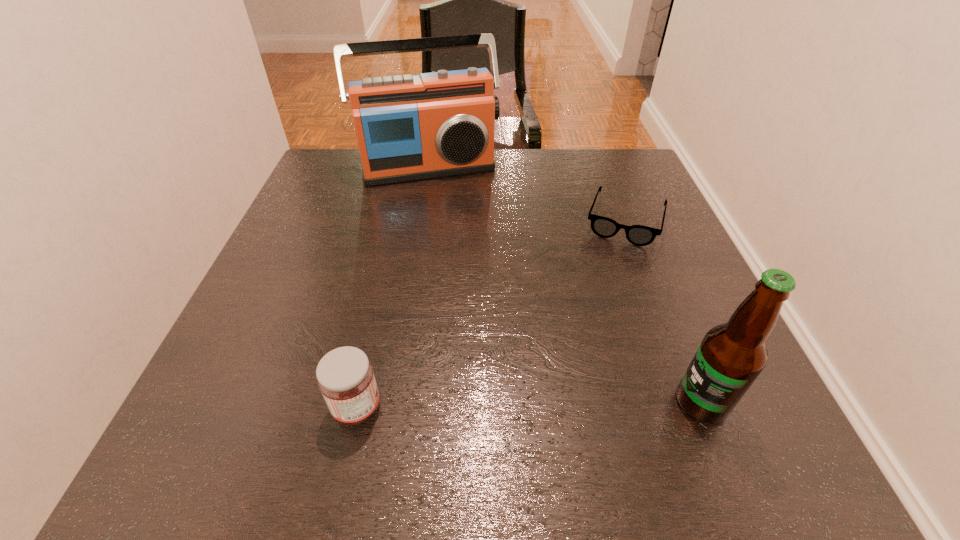
You are a GUI agent. You are given a task and a screenshot of the screen. Output one action in this format:
    pyautogui.click(x=<x>, y=<y>)
    Task: Click on the jam
    The width and height of the screenshot is (960, 540).
    Given the screenshot: What is the action you would take?
    pyautogui.click(x=345, y=376)

Locate an element on the screen. This screenshot has height=540, width=960. the third shortest object is located at coordinates (731, 356).

Locate an element on the screen. the farthest object is located at coordinates pos(438,124).

Find the location of a particular element. the shortest object is located at coordinates (639, 235).

Locate an element on the screen. spectacles is located at coordinates (639, 235).

Find the location of a particular element. The width and height of the screenshot is (960, 540). vacant point located 0.330m on the back of the jam is located at coordinates (391, 255).

You are a GUI agent. You are given a task and a screenshot of the screen. Output one action in this format:
    pyautogui.click(x=<x>, y=<y>)
    Task: Click on the vacant space located on the label of the third shortest object
    The width and height of the screenshot is (960, 540).
    Given the screenshot: What is the action you would take?
    pyautogui.click(x=613, y=403)

Find the location of a particular element. The image size is (960, 540). free space located 0.300m on the label of the third shortest object is located at coordinates (490, 403).

This screenshot has height=540, width=960. I want to click on vacant space located on the label of the third shortest object, so click(x=564, y=403).

You are a GUI agent. You are given a task and a screenshot of the screen. Output one action in this format:
    pyautogui.click(x=<x>, y=<y>)
    Task: Click on the vacant space situated 0.100m on the front-facing side of the farthest object
    
    Given the screenshot: What is the action you would take?
    click(449, 208)